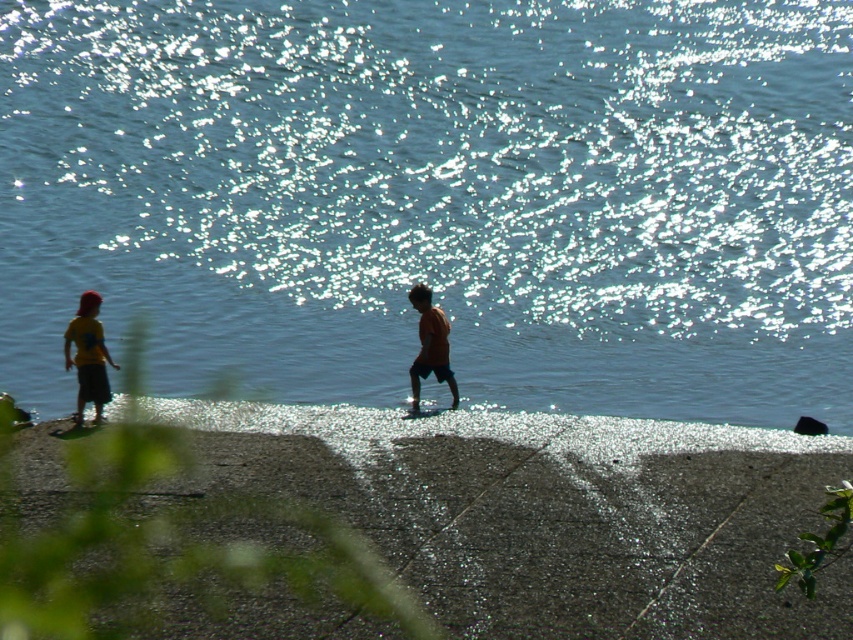
You are standing on the smooth concrete sidewalk at lower center and want to greet the yellow matte shirt at left. In which direction should you walk to reach them?

You should walk to the left because the smooth concrete sidewalk at lower center is positioned on the right side of yellow matte shirt at left, meaning the yellow matte shirt at left is located to your left side.

You are a delivery person carrying a package that is 1 meter wide. You need to walk along the smooth concrete sidewalk at lower center while avoiding the yellow matte shirt at left. Is the sidewalk wide enough to accommodate your package?

The smooth concrete sidewalk at lower center is wider than the yellow matte shirt at left, so it should be wide enough to accommodate your 1 meter wide package while avoiding the yellow matte shirt at left.